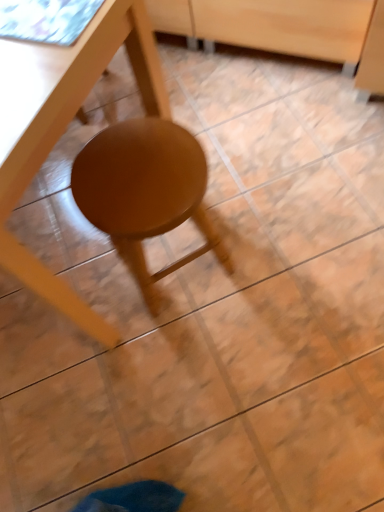
Identify the location of vacant space to the right of matte wood stool at center. This screenshot has width=384, height=512. (278, 243).